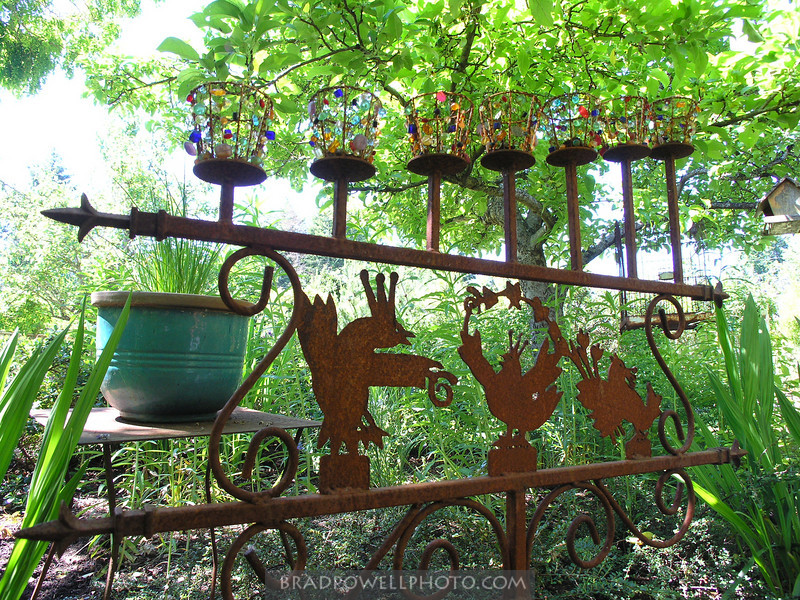
Locate an element on the screen. Image resolution: width=800 pixels, height=600 pixels. table is located at coordinates (160, 429).